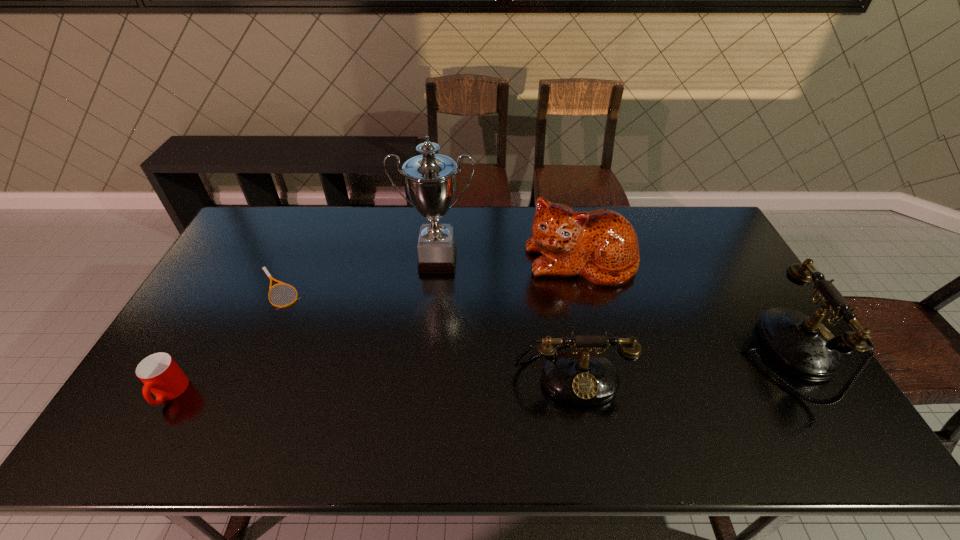
Find the location of a particular element. The width and height of the screenshot is (960, 540). the leftmost object is located at coordinates (161, 375).

Locate an element on the screen. The image size is (960, 540). vacant space located on the front of the tennis racket is located at coordinates click(263, 323).

Where is `vacant region located 0.290m at the front view of the trophy cup`? vacant region located 0.290m at the front view of the trophy cup is located at coordinates (428, 349).

At what (x,y) coordinates should I click in order to perform the action: click on free location located 0.340m on the face of the cat. Please return your answer as a coordinate pair (x, y). This screenshot has width=960, height=540. Looking at the image, I should click on click(610, 380).

Identify the location of trophy cup at the far edge. (430, 179).

Locate an element on the screen. This screenshot has width=960, height=540. cat at the far edge is located at coordinates (601, 245).

Find the location of `cup present at the near edge`. cup present at the near edge is located at coordinates (161, 375).

This screenshot has height=540, width=960. In order to click on tennis racket that is positioned at the left edge in this screenshot , I will do `click(271, 278)`.

Where is `cup that is at the left edge`? cup that is at the left edge is located at coordinates (161, 375).

Where is `object that is at the right edge`? Image resolution: width=960 pixels, height=540 pixels. object that is at the right edge is located at coordinates tap(800, 344).